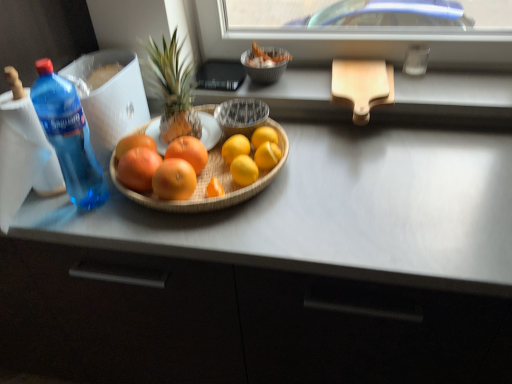
Locate an element on the screen. The height and width of the screenshot is (384, 512). free location in front of blue translucent bottle at left is located at coordinates (95, 230).